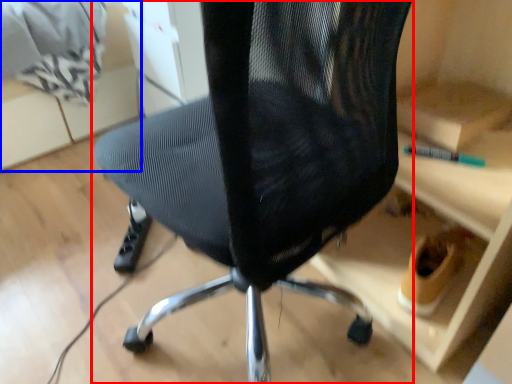
Question: Which of the following is the farthest to the observer, chair (highlighted by a red box) or shelf (highlighted by a blue box)?

Choices:
 (A) chair
 (B) shelf

Answer: (B)